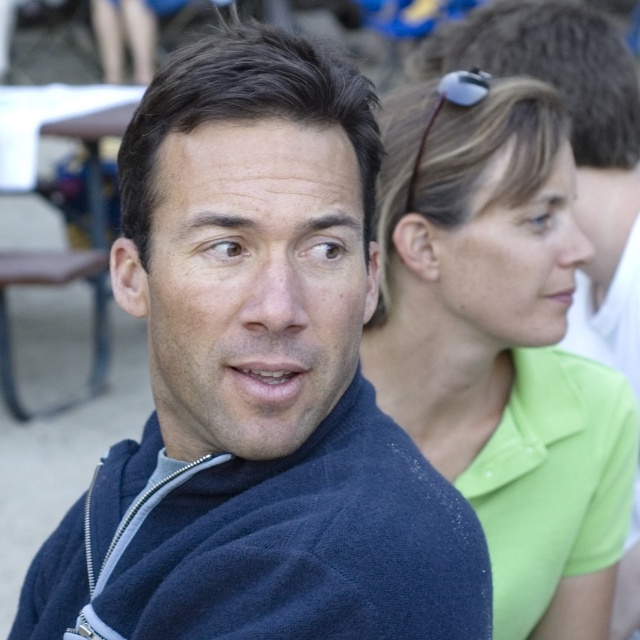
Where is the matte blue sweater at center located in the image?

The matte blue sweater at center is located at point (257,381).

You are a photographer trying to capture a candid shot of both the dark blue fleece sweatshirt at center and the matte green shirt at upper right. Since the background is blurred, you want to ensure both subjects are in focus. Which subject should you focus on first to ensure the other remains sharp in the depth of field?

The dark blue fleece sweatshirt at center is located below the matte green shirt at upper right. To ensure both are in focus, you should focus on the matte green shirt at upper right since it is farther away from the camera compared to the dark blue fleece sweatshirt at center, which is closer. This way, the depth of field will cover both subjects.

You are standing 1 meter away from the point at coordinates point [365,513]. If you want to move closer to that point, how much closer can you get while still being able to see both the man in the foreground and the woman behind him clearly?

The distance of point [365,513] from viewer is 1.11 meters. Since you are currently 1 meter away, you can move 0.11 meters closer to the point while still seeing both individuals clearly.